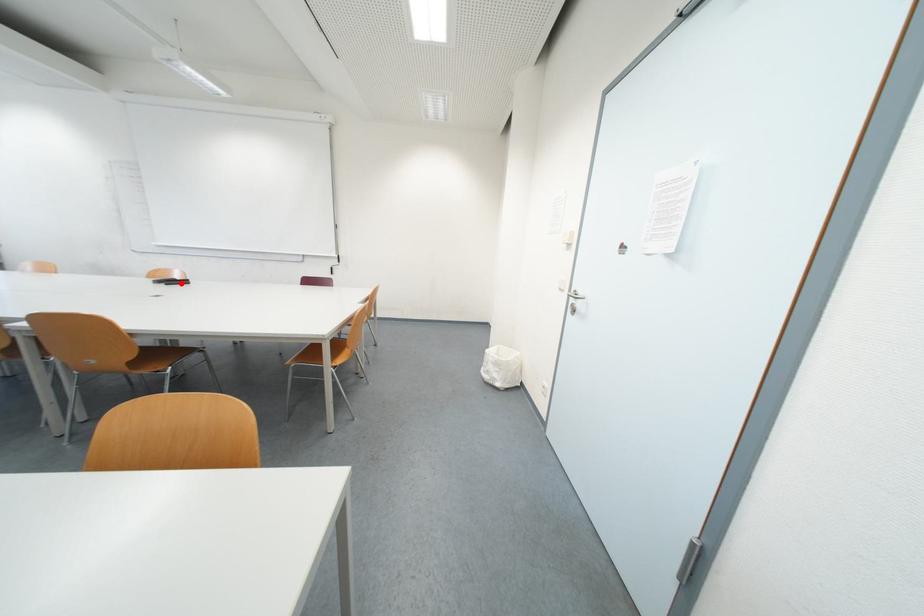
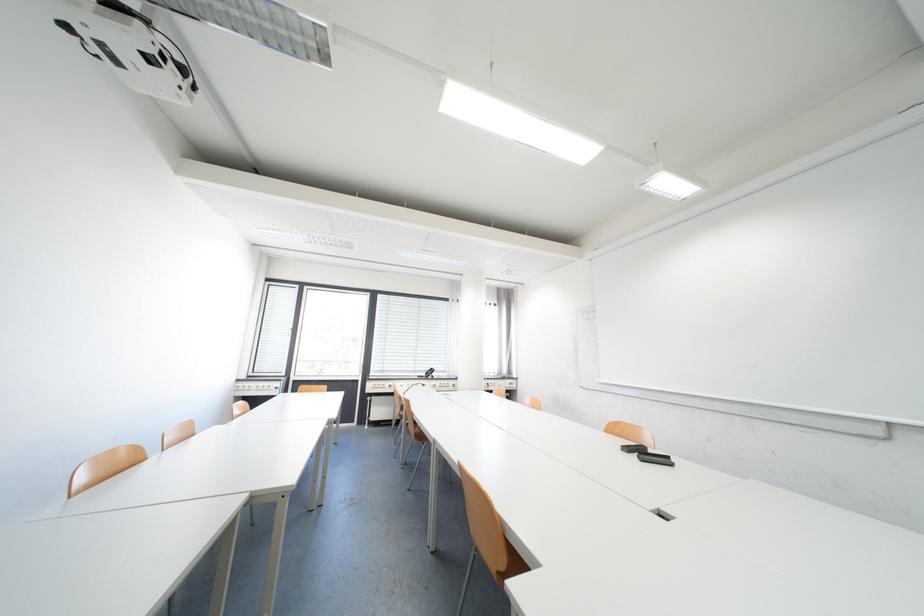
Where in the second image is the point corresponding to the highlighted location from the first image?

(652, 454)